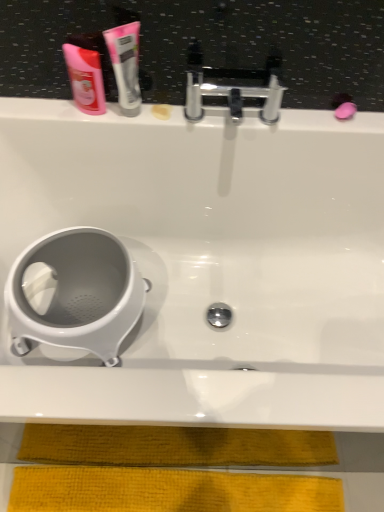
Locate an element on the screen. free spot to the right of white glossy tube at upper center is located at coordinates click(x=178, y=120).